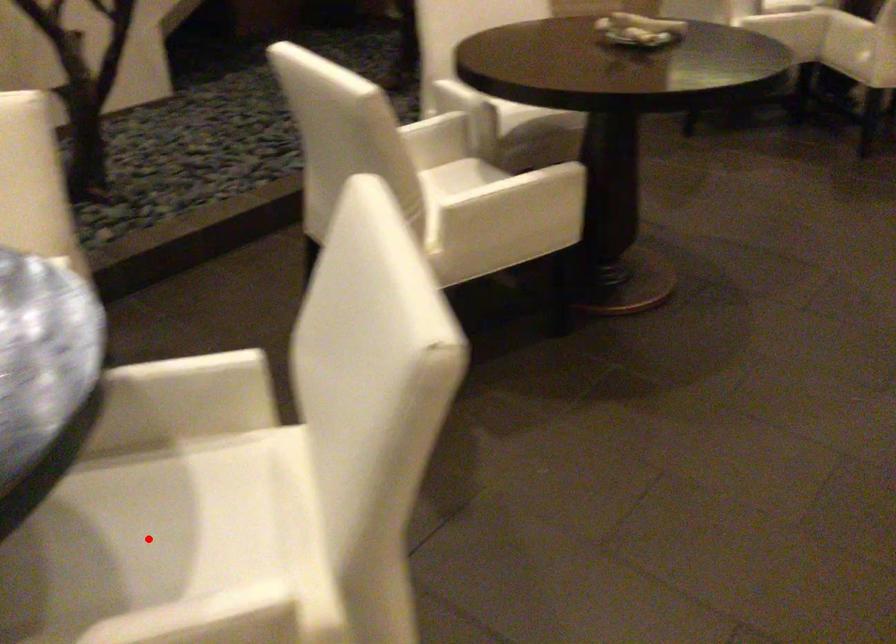
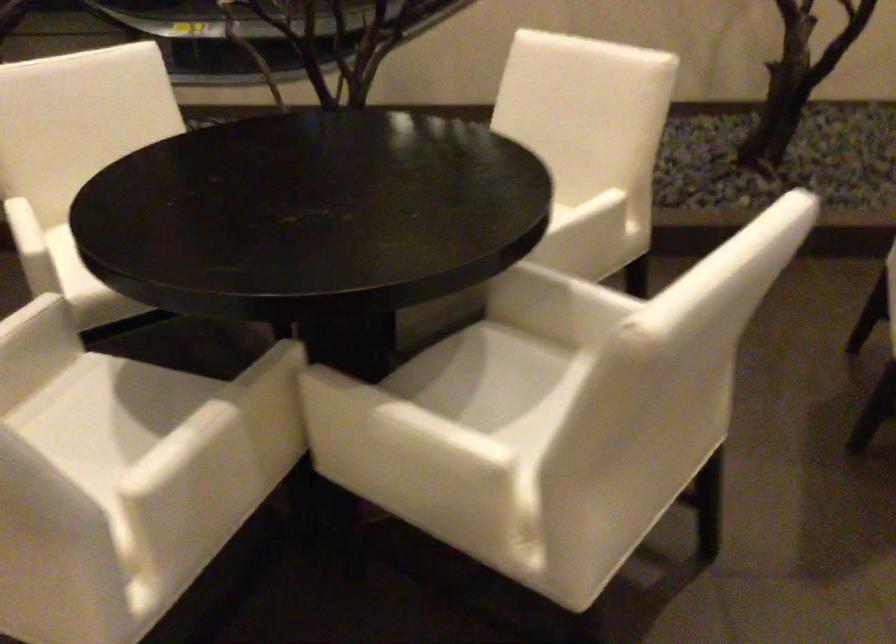
Question: I am providing you with two images of the same scene from different viewpoints. A red point is shown in image1. For the corresponding object point in image2, is it positioned nearer or farther from the camera?

Choices:
 (A) Nearer
 (B) Farther

Answer: (B)